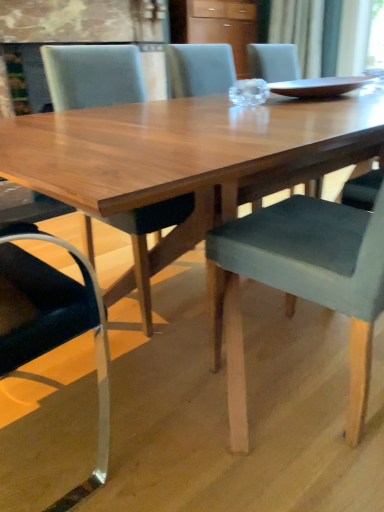
Where is `vacant space that is to the left of velvet grey chair at center, positioned as the second chair in left-to-right order`? The width and height of the screenshot is (384, 512). vacant space that is to the left of velvet grey chair at center, positioned as the second chair in left-to-right order is located at coordinates (182, 393).